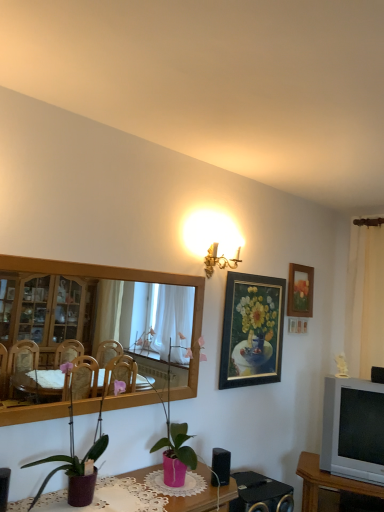
The height and width of the screenshot is (512, 384). Describe the element at coordinates (300, 291) in the screenshot. I see `wooden picture frame at upper right, marked as the 2th picture frame in a front-to-back arrangement` at that location.

The image size is (384, 512). In order to click on purple matte plant pot at lower left, acting as the second houseplant starting from the right in this screenshot , I will do `click(77, 462)`.

Considering the relative positions of wooden mirror at upper left and black plastic speaker at lower right, the first speaker in the top-to-bottom sequence, in the image provided, is wooden mirror at upper left to the left or to the right of black plastic speaker at lower right, the first speaker in the top-to-bottom sequence,?

wooden mirror at upper left is to the left of black plastic speaker at lower right, the first speaker in the top-to-bottom sequence.

From a real-world perspective, is wooden mirror at upper left under black plastic speaker at lower right, the first speaker in the top-to-bottom sequence?

No, from a real-world perspective, wooden mirror at upper left is not beneath black plastic speaker at lower right, the first speaker in the top-to-bottom sequence.

Which of these two, wooden mirror at upper left or black plastic speaker at lower right, marked as the 2th speaker in a left-to-right arrangement, stands shorter?

Standing shorter between the two is black plastic speaker at lower right, marked as the 2th speaker in a left-to-right arrangement.

Considering the relative positions of wooden mirror at upper left and black plastic speaker at lower right, which is the 2th speaker in front-to-back order, in the image provided, is wooden mirror at upper left in front of black plastic speaker at lower right, which is the 2th speaker in front-to-back order,?

Yes, wooden mirror at upper left is in front of black plastic speaker at lower right, which is the 2th speaker in front-to-back order.

The height and width of the screenshot is (512, 384). What are the coordinates of `mirror directly beneath the gold metallic wall sconce at upper center (from a real-world perspective)` in the screenshot? It's located at (97, 314).

Who is bigger, wooden mirror at upper left or gold metallic wall sconce at upper center?

Bigger between the two is wooden mirror at upper left.

Does point (184, 323) appear closer or farther from the camera than point (205, 265)?

Point (184, 323) appears to be closer to the viewer than point (205, 265).

Does wooden mirror at upper left lie in front of gold metallic wall sconce at upper center?

Yes, it is.

In order to click on curtain above the wooden tv stand at lower right, the 2th table from the top (from the image's perspective) in this screenshot , I will do click(x=365, y=301).

From the image's perspective, which one is positioned higher, white fabric curtain at right or wooden tv stand at lower right, the first table viewed from the right?

From the image's view, white fabric curtain at right is above.

Looking at this image, does white fabric curtain at right have a lesser height compared to wooden tv stand at lower right, marked as the first table in a bottom-to-top arrangement?

No, white fabric curtain at right is not shorter than wooden tv stand at lower right, marked as the first table in a bottom-to-top arrangement.

In the scene shown: Does white fabric curtain at right lie in front of wooden tv stand at lower right, marked as the first table in a bottom-to-top arrangement?

No, white fabric curtain at right is further to the viewer.

Image resolution: width=384 pixels, height=512 pixels. In order to click on mirror to the left of white fabric curtain at right in this screenshot , I will do `click(97, 314)`.

From a real-world perspective, between wooden mirror at upper left and white fabric curtain at right, who is vertically higher?

In real-world perspective, white fabric curtain at right is above.

Consider the image. Considering the sizes of objects wooden mirror at upper left and white fabric curtain at right in the image provided, who is taller, wooden mirror at upper left or white fabric curtain at right?

white fabric curtain at right.

Does wooden mirror at upper left have a lesser width compared to white fabric curtain at right?

Indeed, wooden mirror at upper left has a lesser width compared to white fabric curtain at right.

Is pink matte plant pot at center, which is counted as the 2th houseplant, starting from the left, to the right of gold-framed painting at upper right, acting as the 1th picture frame starting from the front, from the viewer's perspective?

Incorrect, pink matte plant pot at center, which is counted as the 2th houseplant, starting from the left, is not on the right side of gold-framed painting at upper right, acting as the 1th picture frame starting from the front.

Does pink matte plant pot at center, marked as the first houseplant in a back-to-front arrangement, touch gold-framed painting at upper right, acting as the 2th picture frame starting from the right?

No.

Is point (167, 466) behind point (279, 311)?

No.

Is pink matte plant pot at center, which is counted as the 1th houseplant, starting from the right, smaller than gold-framed painting at upper right, acting as the 2th picture frame starting from the right?

No.

Considering the relative sizes of gold metallic wall sconce at upper center and black plastic speaker at lower center, which is counted as the second speaker, starting from the back, in the image provided, is gold metallic wall sconce at upper center thinner than black plastic speaker at lower center, which is counted as the second speaker, starting from the back,?

No.

Who is smaller, gold metallic wall sconce at upper center or black plastic speaker at lower center, positioned as the 1th speaker in left-to-right order?

black plastic speaker at lower center, positioned as the 1th speaker in left-to-right order, is smaller.

Is gold metallic wall sconce at upper center not inside black plastic speaker at lower center, which is the 2th speaker from right to left?

Indeed, gold metallic wall sconce at upper center is completely outside black plastic speaker at lower center, which is the 2th speaker from right to left.

Is gold metallic wall sconce at upper center further to the viewer compared to black plastic speaker at lower center, positioned as the 1th speaker in left-to-right order?

Yes, the depth of gold metallic wall sconce at upper center is greater than that of black plastic speaker at lower center, positioned as the 1th speaker in left-to-right order.

Does point (310, 304) come closer to viewer compared to point (67, 474)?

No, it is not.

From the image's perspective, which object appears higher, wooden picture frame at upper right, marked as the first picture frame in a right-to-left arrangement, or purple matte plant pot at lower left, which is the 1th houseplant from front to back?

wooden picture frame at upper right, marked as the first picture frame in a right-to-left arrangement, from the image's perspective.

Is wooden picture frame at upper right, which is counted as the first picture frame, starting from the back, directly adjacent to purple matte plant pot at lower left, acting as the second houseplant starting from the right?

No, wooden picture frame at upper right, which is counted as the first picture frame, starting from the back, is not beside purple matte plant pot at lower left, acting as the second houseplant starting from the right.

Which is in front, wooden picture frame at upper right, which is counted as the 2th picture frame, starting from the left, or purple matte plant pot at lower left, the 2th houseplant from the back?

purple matte plant pot at lower left, the 2th houseplant from the back, is in front.

The height and width of the screenshot is (512, 384). In order to click on mirror positioned vertically above the black plastic speaker at lower right, which is the 2th speaker in front-to-back order (from a real-world perspective) in this screenshot , I will do `click(97, 314)`.

I want to click on mirror that appears below the gold metallic wall sconce at upper center (from the image's perspective), so click(x=97, y=314).

Estimate the real-world distances between objects in this image. Which object is closer to matte pink vase at lower center, which appears as the second table when viewed from the back, wooden mirror at upper left or black plastic speaker at lower center, arranged as the 1th speaker when viewed from the front?

Based on the image, black plastic speaker at lower center, arranged as the 1th speaker when viewed from the front, appears to be nearer to matte pink vase at lower center, which appears as the second table when viewed from the back.

Considering their positions, is black plastic speaker at lower center, the 1th speaker when ordered from bottom to top, positioned further to gold metallic wall sconce at upper center than white fabric curtain at right?

white fabric curtain at right is positioned further to the anchor gold metallic wall sconce at upper center.

Looking at the image, which one is located closer to wooden picture frame at upper right, marked as the 2th picture frame in a front-to-back arrangement, purple matte plant pot at lower left, which is the 1th houseplant from front to back, or silver metallic television at right?

Among the two, silver metallic television at right is located nearer to wooden picture frame at upper right, marked as the 2th picture frame in a front-to-back arrangement.

In the scene shown: Estimate the real-world distances between objects in this image. Which object is further from wooden tv stand at lower right, which is the second table in left-to-right order, gold metallic wall sconce at upper center or white fabric curtain at right?

The object further to wooden tv stand at lower right, which is the second table in left-to-right order, is gold metallic wall sconce at upper center.

Estimate the real-world distances between objects in this image. Which object is closer to purple matte plant pot at lower left, which is the first houseplant in left-to-right order, silver metallic television at right or black plastic speaker at lower center, which is counted as the second speaker, starting from the back?

The object closer to purple matte plant pot at lower left, which is the first houseplant in left-to-right order, is black plastic speaker at lower center, which is counted as the second speaker, starting from the back.

From the image, which object appears to be nearer to matte pink vase at lower center, which appears as the first table when viewed from the front, wooden tv stand at lower right, marked as the first table in a back-to-front arrangement, or wooden mirror at upper left?

wooden tv stand at lower right, marked as the first table in a back-to-front arrangement, is positioned closer to the anchor matte pink vase at lower center, which appears as the first table when viewed from the front.

Which object lies nearer to the anchor point matte pink vase at lower center, the second table positioned from the bottom, wooden tv stand at lower right, the first table viewed from the right, or gold metallic wall sconce at upper center?

wooden tv stand at lower right, the first table viewed from the right.

Looking at the image, which one is located further to matte pink vase at lower center, which appears as the second table when viewed from the right, gold metallic wall sconce at upper center or black plastic speaker at lower center, which ranks as the 2th speaker in top-to-bottom order?

gold metallic wall sconce at upper center.

The image size is (384, 512). I want to click on curtain between gold metallic wall sconce at upper center and wooden tv stand at lower right, marked as the first table in a bottom-to-top arrangement, from top to bottom, so click(x=365, y=301).

Locate an element on the screen. mirror located between matte pink vase at lower center, which is the first table in left-to-right order, and gold-framed painting at upper right, acting as the 1th picture frame starting from the front, in the depth direction is located at coordinates (97, 314).

Identify the location of speaker located between matte pink vase at lower center, which appears as the 1th table when viewed from the top, and black plastic speaker at lower right, the 1th speaker from the right, in the left-right direction. (221, 465).

You are a GUI agent. You are given a task and a screenshot of the screen. Output one action in this format:
    pyautogui.click(x=<x>, y=<y>)
    Task: Click on the speaker between wooden mirror at upper left and silver metallic television at right from left to right
    
    Given the screenshot: What is the action you would take?
    pyautogui.click(x=221, y=465)